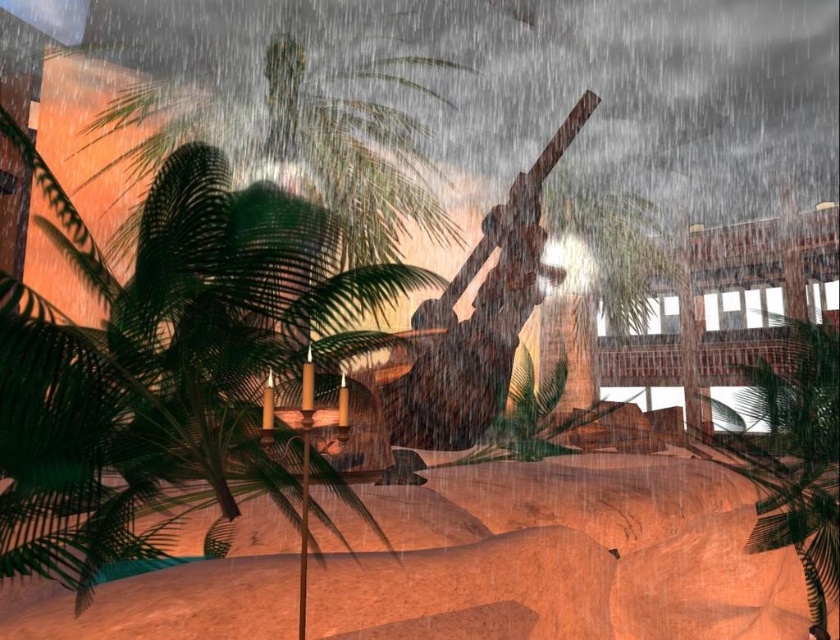
Question: Which point is farther from the camera taking this photo?

Choices:
 (A) [x=807, y=438]
 (B) [x=633, y=276]

Answer: (B)

Question: Can you confirm if green leafy palm tree at right is smaller than green leafy palm tree at center?

Choices:
 (A) yes
 (B) no

Answer: (B)

Question: Which object appears closest to the camera in this image?

Choices:
 (A) green leafy palm tree at center
 (B) green leafy palm tree at right

Answer: (B)

Question: Can you confirm if green leafy palm tree at right is wider than green leafy palm tree at center?

Choices:
 (A) no
 (B) yes

Answer: (B)

Question: Is green leafy palm tree at right wider than green leafy palm tree at center?

Choices:
 (A) no
 (B) yes

Answer: (B)